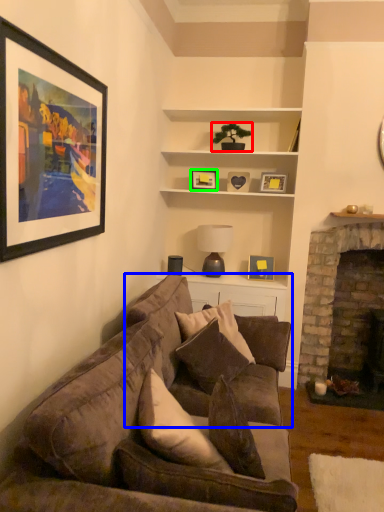
Question: Considering the real-world distances, which object is farthest from houseplant (highlighted by a red box)? studio couch (highlighted by a blue box) or picture frame (highlighted by a green box)?

Choices:
 (A) studio couch
 (B) picture frame

Answer: (A)